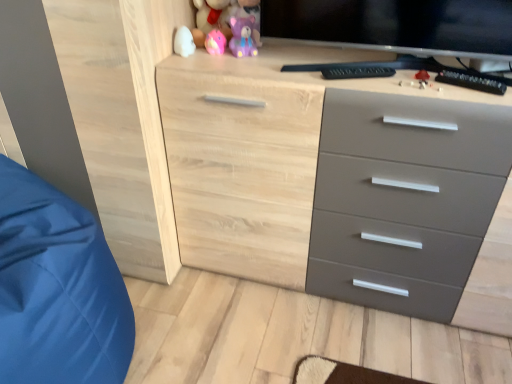
This screenshot has height=384, width=512. I want to click on free space in front of purple matte bear at upper center, the 3th toy from the top, so point(246,64).